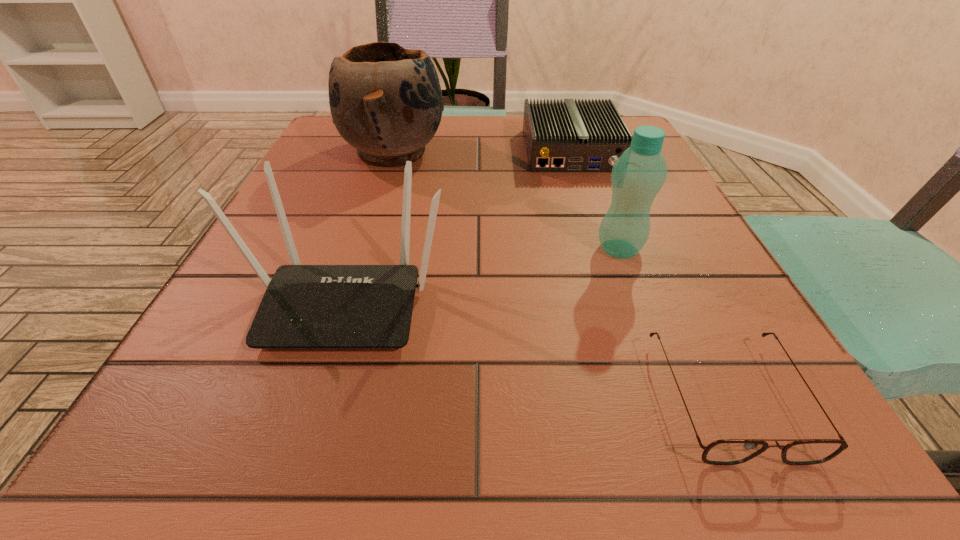
Locate an element on the screen. pottery is located at coordinates (386, 101).

Where is `bottle`? bottle is located at coordinates (637, 176).

Find the location of `the nearer router`. the nearer router is located at coordinates (304, 306).

Where is `the taller router`? Image resolution: width=960 pixels, height=540 pixels. the taller router is located at coordinates (304, 306).

What are the coordinates of `the shorter router` in the screenshot? It's located at (568, 136).

Locate an element on the screen. Image resolution: width=960 pixels, height=540 pixels. the right router is located at coordinates (568, 136).

Locate an element on the screen. sunglasses is located at coordinates (725, 451).

Find the location of a particular element. Image resolution: width=960 pixels, height=540 pixels. vacant space situated 0.240m on the right of the pottery is located at coordinates (554, 152).

This screenshot has width=960, height=540. Find the location of `vacant space positioned on the back of the bottle`. vacant space positioned on the back of the bottle is located at coordinates (583, 150).

Find the location of a particular element. free region located 0.050m on the front-facing side of the third shortest object is located at coordinates (317, 390).